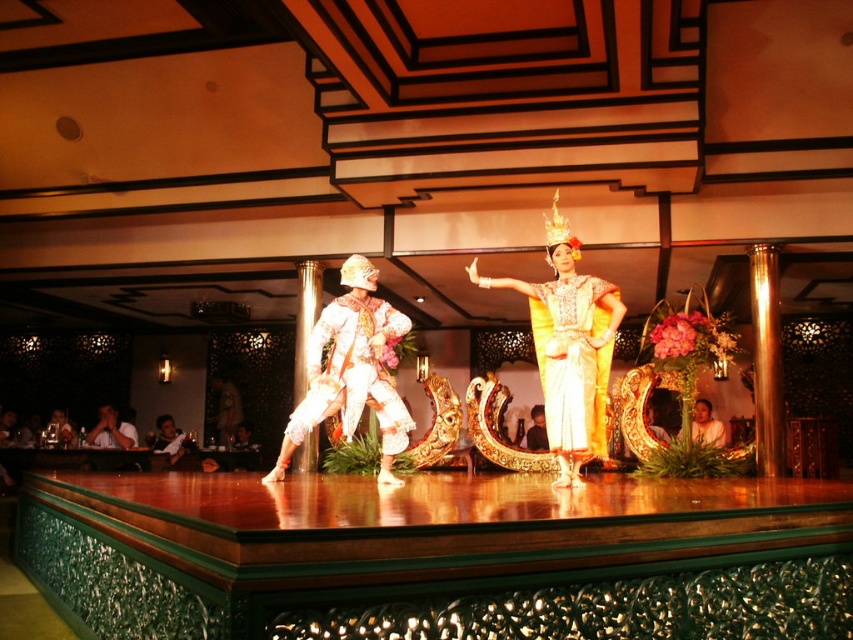
You are a photographer positioned at the back of the audience. You notice two golden silk garments on stage at center. Which one is taller between the gold silk dress at center and the golden silk skirt at center?

The gold silk dress at center is taller than the golden silk skirt at center.

Looking at this image, you are a stage designer observing the performance. You need to determine which of the two items, the gold silk dress at center or the golden silk skirt at center, would require less fabric to create. Based on the description provided, which one would you choose?

The gold silk dress at center is thinner than the golden silk skirt at center, so the gold silk dress at center would require less fabric to create.

You are a photographer capturing the stage performance. You notice the golden silk dress at center and the golden silk skirt at center. Which one appears to be covering part of the other?

The golden silk dress at center is positioned over golden silk skirt at center, so the dress is covering part of the skirt.